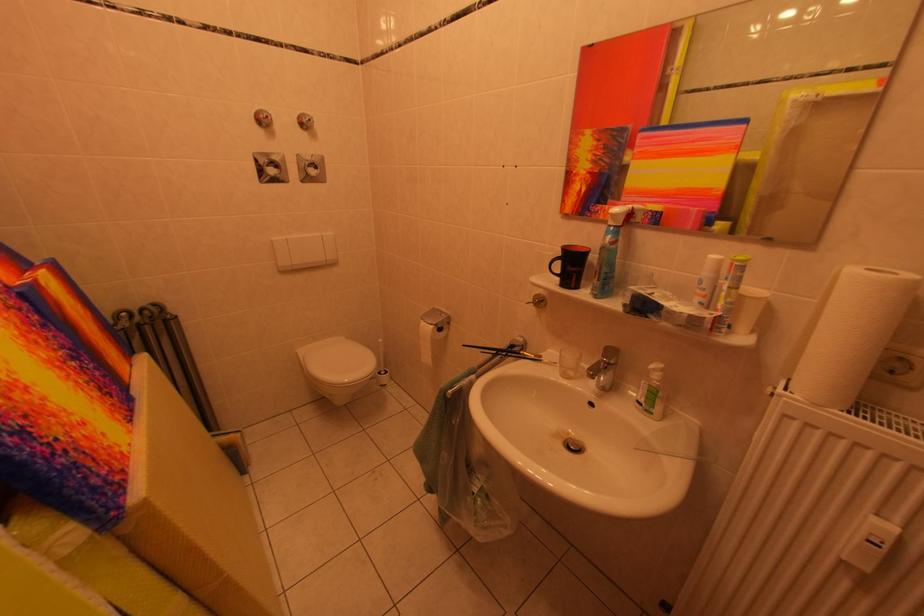
What do you see at coordinates (382, 368) in the screenshot? The height and width of the screenshot is (616, 924). I see `a white toilet brush handle` at bounding box center [382, 368].